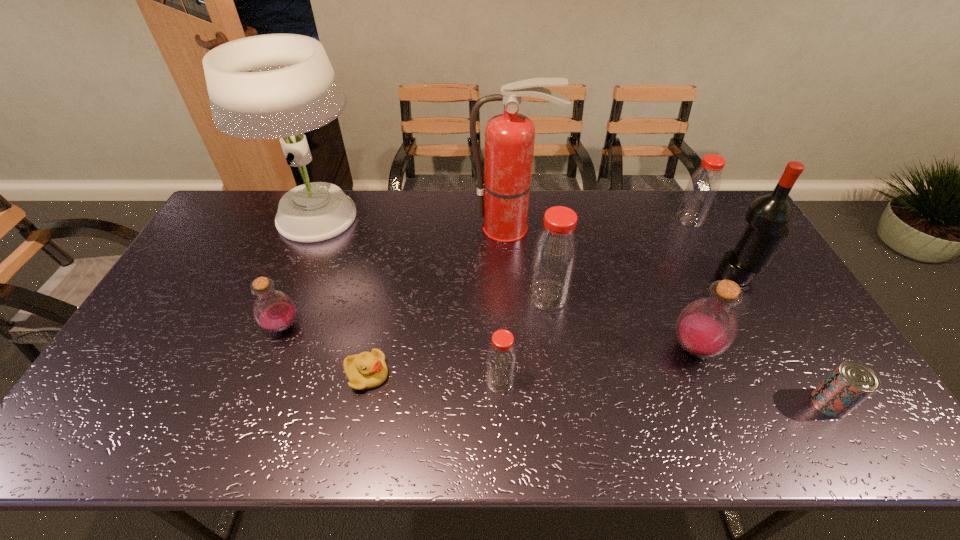
Locate which object ranks third in proximity to the red fire extinguisher. Please provide its 2D coordinates. Your answer should be formatted as a tuple, i.e. [(x, y)], where the tuple contains the x and y coordinates of a point satisfying the conditions above.

[(707, 327)]

Select which object appears as the sixth closest to the nearest red bottle. Please provide its 2D coordinates. Your answer should be formatted as a tuple, i.e. [(x, y)], where the tuple contains the x and y coordinates of a point satisfying the conditions above.

[(270, 86)]

This screenshot has width=960, height=540. I want to click on the fourth closest bottle to the left purple bottle, so click(x=703, y=186).

You are a GUI agent. You are given a task and a screenshot of the screen. Output one action in this format:
    pyautogui.click(x=<x>, y=<y>)
    Task: Click on the fifth closest bottle to the beer can
    The width and height of the screenshot is (960, 540).
    Given the screenshot: What is the action you would take?
    pyautogui.click(x=274, y=311)

Identify the location of red bottle that stands as the third closest to the red beer can. (501, 359).

Find the location of a particular element. This screenshot has width=960, height=540. red bottle identified as the second closest to the white lamp is located at coordinates (501, 359).

At what (x,y) coordinates should I click in order to perform the action: click on vacant region that satisfies the following two spatial constraints: 1. on the front side of the fourth bottle from left to right; 2. on the left side of the red beer can. Please return your answer as a coordinate pair (x, y). Looking at the image, I should click on (716, 403).

Identify the location of free spot that satisfies the following two spatial constraints: 1. on the front-facing side of the white lamp; 2. on the left side of the red beer can. Image resolution: width=960 pixels, height=540 pixels. 244,403.

You are a GUI agent. You are given a task and a screenshot of the screen. Output one action in this format:
    pyautogui.click(x=<x>, y=<y>)
    Task: Click on the blank space that satisfies the following two spatial constraints: 1. with the handle and hose on the second red bottle from left to right; 2. on the right side of the fire extinguisher
    The image size is (960, 540).
    Given the screenshot: What is the action you would take?
    pyautogui.click(x=516, y=295)

Find the location of `vacant space that satisfies the following two spatial constraints: 1. on the front side of the red beer can; 2. on the right side of the second bottle from left to right`. vacant space that satisfies the following two spatial constraints: 1. on the front side of the red beer can; 2. on the right side of the second bottle from left to right is located at coordinates (501, 403).